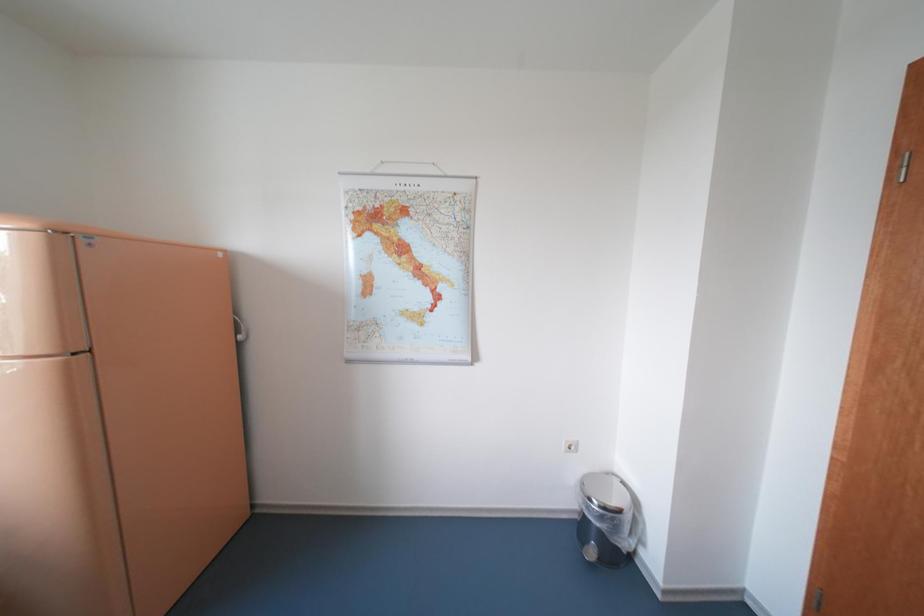
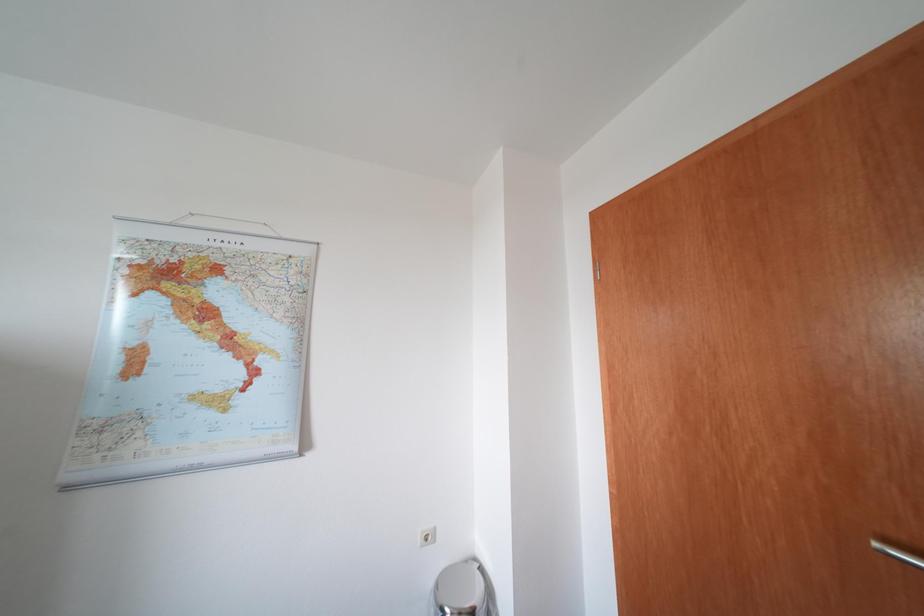
Question: What movement of the cameraman would produce the second image?

Choices:
 (A) Left
 (B) Right
 (C) Forward
 (D) Backward

Answer: (B)